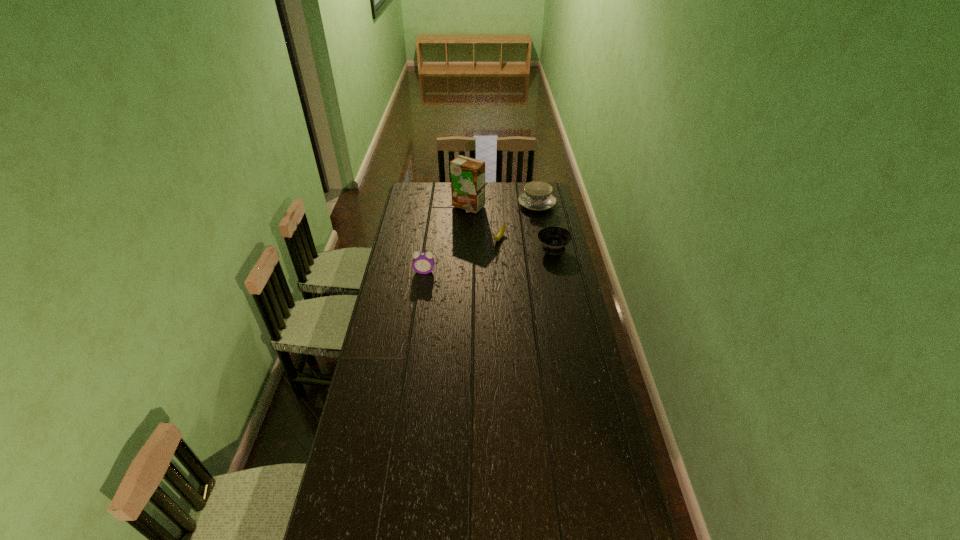
Locate an element on the screen. The height and width of the screenshot is (540, 960). free spot between the chinaware and the carton is located at coordinates (502, 206).

In order to click on free spot between the alarm clock and the chinaware in this screenshot , I will do `click(480, 238)`.

The image size is (960, 540). In order to click on empty space between the tallest object and the chinaware in this screenshot , I will do `click(502, 206)`.

The height and width of the screenshot is (540, 960). I want to click on empty space between the alarm clock and the chinaware, so click(x=480, y=238).

This screenshot has height=540, width=960. In order to click on vacant point located between the chinaware and the bowl in this screenshot , I will do `click(544, 227)`.

Locate an element on the screen. This screenshot has height=540, width=960. vacant space in between the carton and the alarm clock is located at coordinates (446, 239).

Where is `vacant area that lies between the tallest object and the third object from right to left`? The image size is (960, 540). vacant area that lies between the tallest object and the third object from right to left is located at coordinates (483, 223).

I want to click on empty space between the leftmost object and the third object from right to left, so click(x=462, y=255).

At what (x,y) coordinates should I click in order to perform the action: click on vacant area that lies between the carton and the bowl. Please return your answer as a coordinate pair (x, y). This screenshot has height=540, width=960. Looking at the image, I should click on (511, 228).

Where is `free space between the chinaware and the carton`? The width and height of the screenshot is (960, 540). free space between the chinaware and the carton is located at coordinates (502, 206).